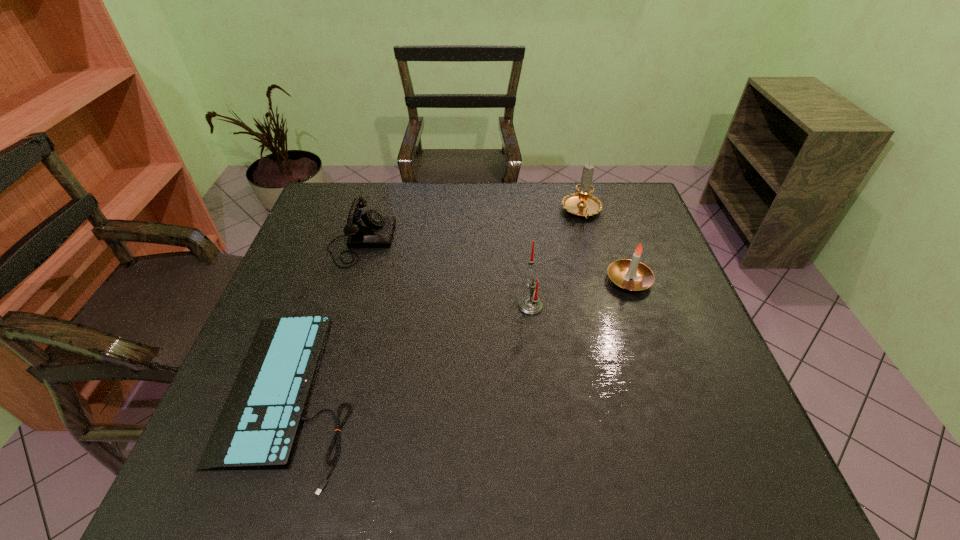
What are the coordinates of `vacant area at the far edge` in the screenshot? It's located at (536, 208).

Where is `blank space at the near edge`? The height and width of the screenshot is (540, 960). blank space at the near edge is located at coordinates (665, 490).

Where is `free location at the right edge`? Image resolution: width=960 pixels, height=540 pixels. free location at the right edge is located at coordinates (725, 398).

Where is `free region at the far left corner of the desktop`? free region at the far left corner of the desktop is located at coordinates (343, 220).

In the image, there is a desktop. At what (x,y) coordinates should I click in order to perform the action: click on free region at the near left corner. Please return your answer as a coordinate pair (x, y). Looking at the image, I should click on (272, 495).

In the image, there is a desktop. At what (x,y) coordinates should I click in order to perform the action: click on vacant space at the far right corner. Please return your answer as a coordinate pair (x, y). The height and width of the screenshot is (540, 960). Looking at the image, I should click on (597, 184).

Where is `free spot between the shortest object and the farthest candle`? free spot between the shortest object and the farthest candle is located at coordinates point(437,303).

Locate an element on the screen. The width and height of the screenshot is (960, 540). vacant point located between the telephone and the shortest candle is located at coordinates (495, 260).

Identify the location of vacant area between the fourth tallest object and the leftmost candle. (445, 273).

What are the coordinates of `free space between the shortest candle and the farthest candle` in the screenshot? It's located at (606, 246).